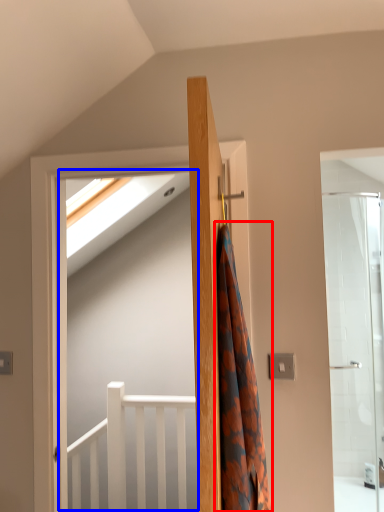
Question: Which object is closer to the camera taking this photo, shower curtain (highlighted by a red box) or screen door (highlighted by a blue box)?

Choices:
 (A) shower curtain
 (B) screen door

Answer: (A)